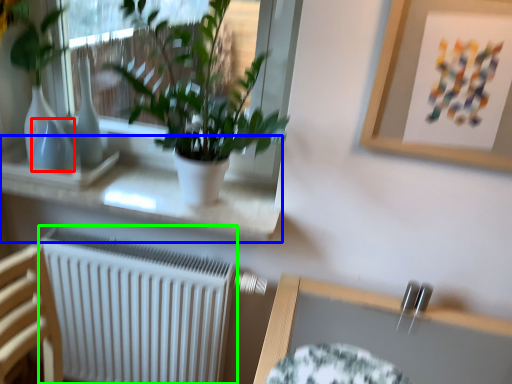
Question: Considering the real-world distances, which object is farthest from vase (highlighted by a red box)? window sill (highlighted by a blue box) or radiator (highlighted by a green box)?

Choices:
 (A) window sill
 (B) radiator

Answer: (B)